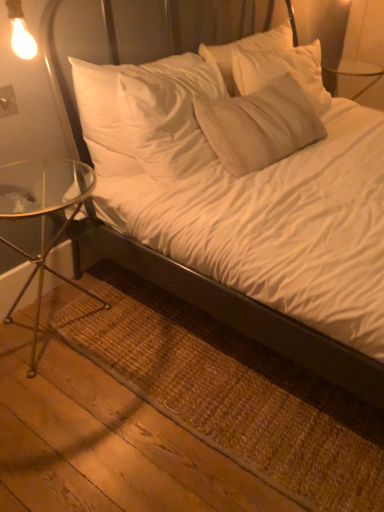
Question: Based on their sizes in the image, would you say white soft bed at center is bigger or smaller than brown woven mat at lower left?

Choices:
 (A) small
 (B) big

Answer: (B)

Question: Is white soft bed at center situated inside brown woven mat at lower left or outside?

Choices:
 (A) outside
 (B) inside

Answer: (A)

Question: Which is nearer to the white soft bed at center?

Choices:
 (A) clear glass table at left
 (B) brown woven mat at lower left

Answer: (B)

Question: Based on their relative distances, which object is farther from the brown woven mat at lower left?

Choices:
 (A) white soft bed at center
 (B) clear glass table at left

Answer: (B)